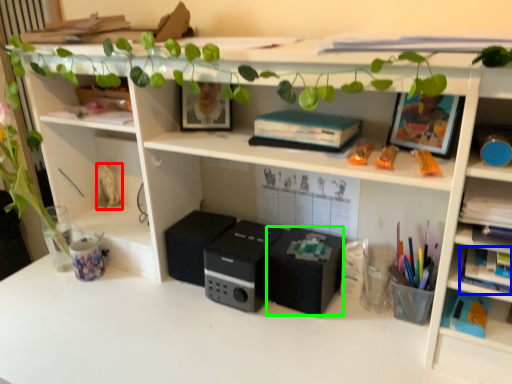
Question: Which is farther away from toy (highlighted by a red box)? book (highlighted by a blue box) or speaker (highlighted by a green box)?

Choices:
 (A) book
 (B) speaker

Answer: (A)